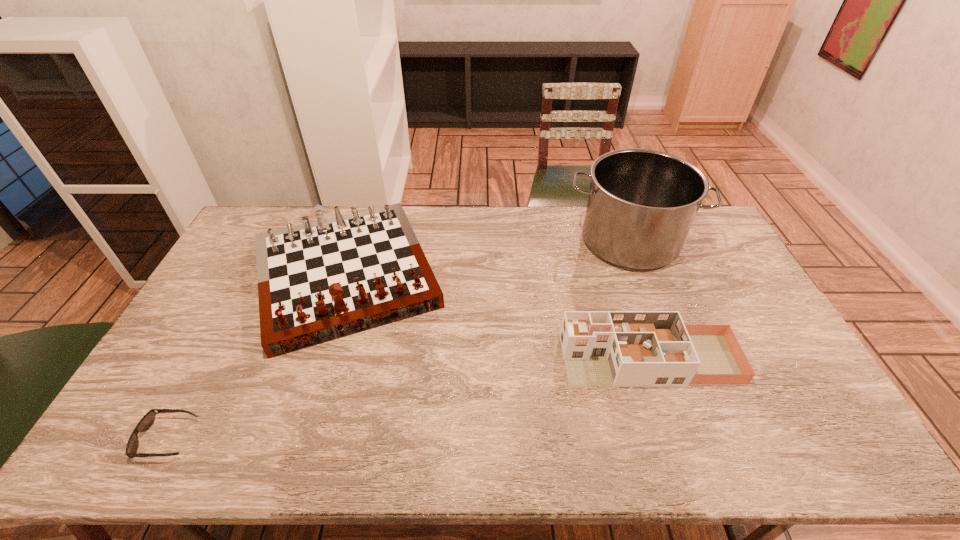
Where is `free space at the far edge`? The height and width of the screenshot is (540, 960). free space at the far edge is located at coordinates (484, 233).

The image size is (960, 540). In the image, there is a desktop. In order to click on free space at the left edge in this screenshot , I will do `click(214, 360)`.

This screenshot has height=540, width=960. In the image, there is a desktop. Identify the location of free space at the right edge. (708, 274).

In the image, there is a desktop. Identify the location of vacant space at the far left corner. The width and height of the screenshot is (960, 540). (261, 209).

Where is `vacant area that lies between the dollhouse and the gameboard`? vacant area that lies between the dollhouse and the gameboard is located at coordinates (497, 318).

Locate an element on the screen. This screenshot has width=960, height=540. vacant space that's between the third shortest object and the nearest object is located at coordinates (256, 357).

The image size is (960, 540). In order to click on unoccupied position between the gameboard and the third tallest object in this screenshot , I will do `click(497, 318)`.

The height and width of the screenshot is (540, 960). I want to click on vacant space that's between the tallest object and the nearest object, so click(x=398, y=340).

You are a GUI agent. You are given a task and a screenshot of the screen. Output one action in this format:
    pyautogui.click(x=<x>, y=<y>)
    Task: Click on the free space between the dollhouse and the shortest object
    The width and height of the screenshot is (960, 540).
    Given the screenshot: What is the action you would take?
    pyautogui.click(x=408, y=399)

Where is `free spot between the saucepan and the second shortest object`? The width and height of the screenshot is (960, 540). free spot between the saucepan and the second shortest object is located at coordinates (639, 300).